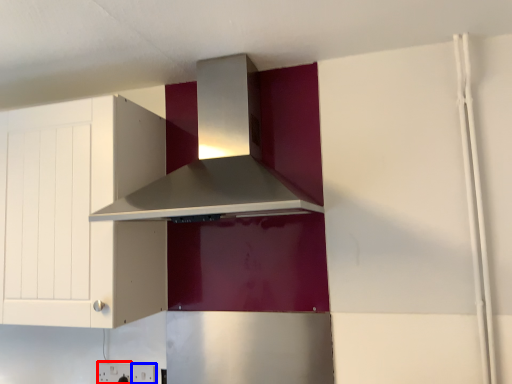
Question: Which point is further to the camera, electric outlet (highlighted by a red box) or electric outlet (highlighted by a blue box)?

Choices:
 (A) electric outlet
 (B) electric outlet

Answer: (A)